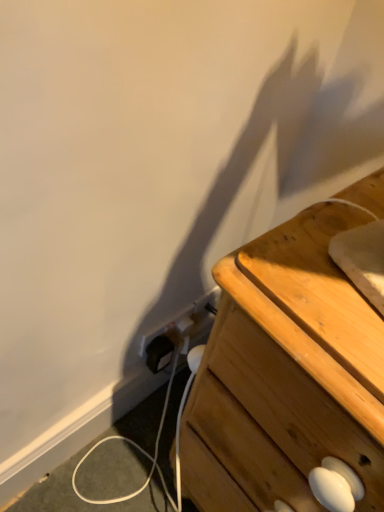
Question: Does white plastic electric outlet at lower center lie behind wooden chest of drawers at right?

Choices:
 (A) yes
 (B) no

Answer: (A)

Question: From the image's perspective, is white plastic electric outlet at lower center on wooden chest of drawers at right?

Choices:
 (A) no
 (B) yes

Answer: (B)

Question: Is white plastic electric outlet at lower center positioned with its back to wooden chest of drawers at right?

Choices:
 (A) no
 (B) yes

Answer: (A)

Question: Does white plastic electric outlet at lower center come in front of wooden chest of drawers at right?

Choices:
 (A) yes
 (B) no

Answer: (B)

Question: From the image's perspective, is white plastic electric outlet at lower center under wooden chest of drawers at right?

Choices:
 (A) yes
 (B) no

Answer: (B)

Question: Can you confirm if white plastic electric outlet at lower center is wider than wooden chest of drawers at right?

Choices:
 (A) no
 (B) yes

Answer: (A)

Question: Can you confirm if wooden chest of drawers at right is smaller than white plastic electric outlet at lower center?

Choices:
 (A) yes
 (B) no

Answer: (B)

Question: Is wooden chest of drawers at right turned away from white plastic electric outlet at lower center?

Choices:
 (A) no
 (B) yes

Answer: (A)

Question: From the image's perspective, is wooden chest of drawers at right on top of white plastic electric outlet at lower center?

Choices:
 (A) no
 (B) yes

Answer: (A)

Question: Are wooden chest of drawers at right and white plastic electric outlet at lower center located far from each other?

Choices:
 (A) yes
 (B) no

Answer: (B)

Question: Can white plastic electric outlet at lower center be found inside wooden chest of drawers at right?

Choices:
 (A) no
 (B) yes

Answer: (A)

Question: Is wooden chest of drawers at right positioned behind white plastic electric outlet at lower center?

Choices:
 (A) no
 (B) yes

Answer: (A)

Question: Relative to white plastic electric outlet at lower center, is wooden chest of drawers at right in front or behind?

Choices:
 (A) behind
 (B) front

Answer: (B)